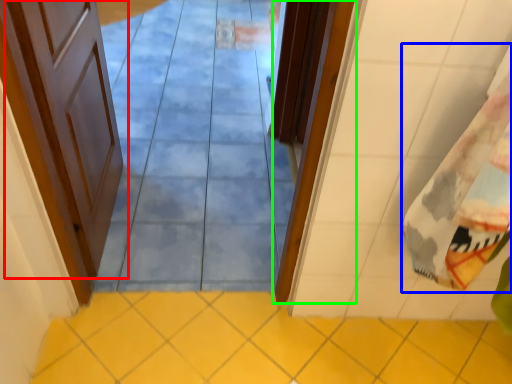
Question: Which object is the farthest from door (highlighted by a red box)? Choose among these: beach towel (highlighted by a blue box) or door (highlighted by a green box).

Choices:
 (A) beach towel
 (B) door

Answer: (A)